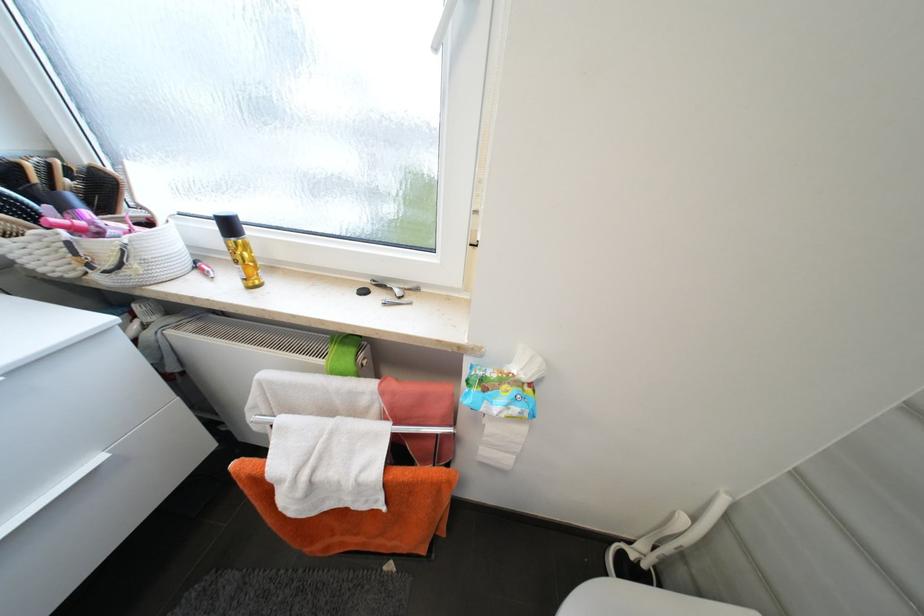
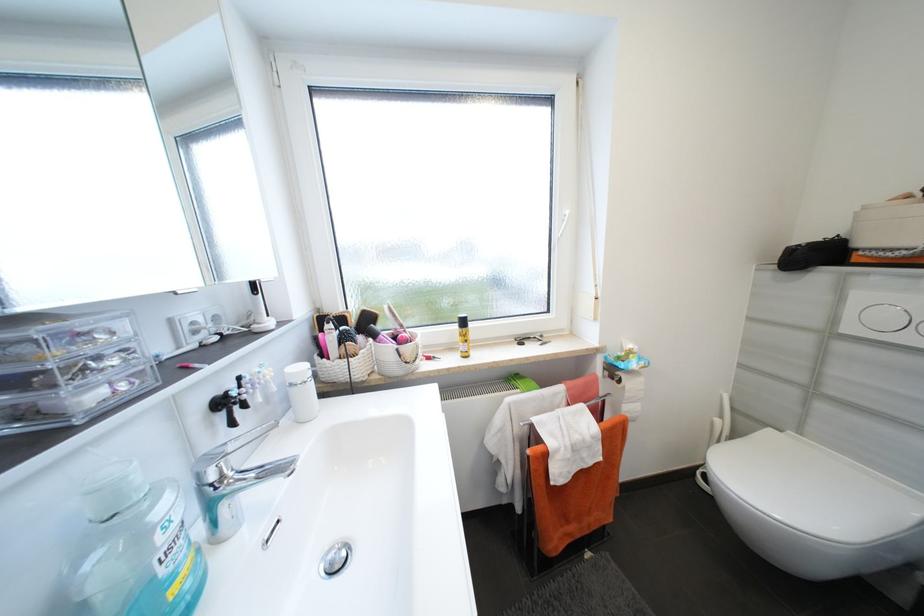
Based on the continuous images, in which direction is the camera rotating?

The camera's rotation is toward right-up.